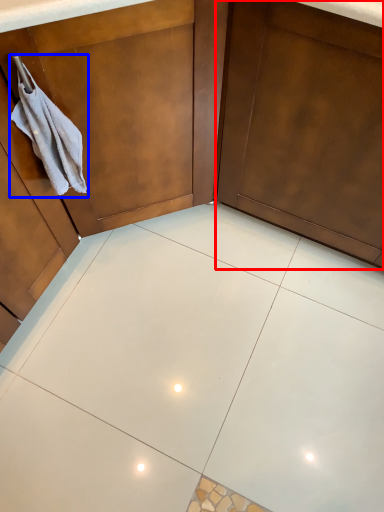
Question: Which of the following is the farthest to the observer, door (highlighted by a red box) or hand towel (highlighted by a blue box)?

Choices:
 (A) door
 (B) hand towel

Answer: (B)